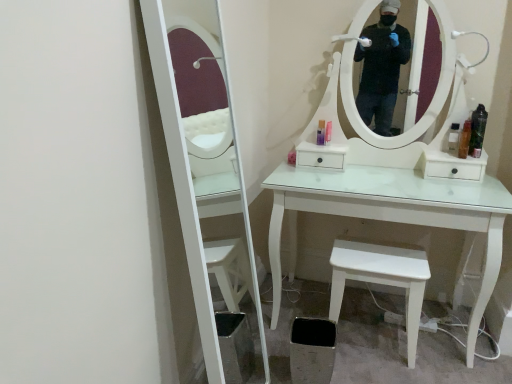
What do you see at coordinates (328, 132) in the screenshot?
I see `pink plastic bottle at center, marked as the 4th toiletry in a right-to-left arrangement` at bounding box center [328, 132].

This screenshot has width=512, height=384. What do you see at coordinates (321, 133) in the screenshot? I see `matte purple bottle at center, placed as the fifth toiletry when sorted from right to left` at bounding box center [321, 133].

Describe the element at coordinates (382, 277) in the screenshot. The width and height of the screenshot is (512, 384). I see `white matte stool at lower right` at that location.

The width and height of the screenshot is (512, 384). I want to click on white matte stool at lower right, so click(x=382, y=277).

Identify the location of translucent plastic bottle at right, the 1th toiletry viewed from the right. (477, 130).

Is translucent plastic bottle at right, the fourth toiletry when ordered from left to right, turned away from matte purple bottle at center, the 1th toiletry from the left?

That's not correct — translucent plastic bottle at right, the fourth toiletry when ordered from left to right, is not looking away from matte purple bottle at center, the 1th toiletry from the left.

Locate an element on the screen. Image resolution: width=512 pixels, height=384 pixels. toiletry that is the 2nd one below the translucent plastic bottle at right, the fourth toiletry when ordered from left to right (from a real-world perspective) is located at coordinates (321, 133).

Does translucent plastic bottle at right, the fourth toiletry when ordered from left to right, have a larger size compared to matte purple bottle at center, placed as the fifth toiletry when sorted from right to left?

Indeed, translucent plastic bottle at right, the fourth toiletry when ordered from left to right, has a larger size compared to matte purple bottle at center, placed as the fifth toiletry when sorted from right to left.

Is translucent plastic bottle at right, acting as the 2th toiletry starting from the right, far from matte purple bottle at center, the 1th toiletry from the left?

They are positioned close to each other.

Which object is further away from the camera, matte purple bottle at center, the 1th toiletry from the left, or pink plastic bottle at center, which appears as the second toiletry when viewed from the left?

Positioned behind is matte purple bottle at center, the 1th toiletry from the left.

Is matte purple bottle at center, placed as the fifth toiletry when sorted from right to left, at the right side of pink plastic bottle at center, which appears as the second toiletry when viewed from the left?

No.

Between point (324, 139) and point (330, 127), which one is positioned in front?

Point (330, 127)

Which object is more forward, translucent plastic bottle at right, the 1th toiletry viewed from the right, or white matte stool at lower right?

white matte stool at lower right.

Is translucent plastic bottle at right, the 1th toiletry viewed from the right, positioned with its back to white matte stool at lower right?

No.

Who is shorter, translucent plastic bottle at right, placed as the 5th toiletry when sorted from left to right, or white matte stool at lower right?

translucent plastic bottle at right, placed as the 5th toiletry when sorted from left to right.

Considering the relative sizes of translucent plastic bottle at right, the 1th toiletry viewed from the right, and white matte stool at lower right in the image provided, is translucent plastic bottle at right, the 1th toiletry viewed from the right, smaller than white matte stool at lower right?

Yes.

Locate an element on the screen. Image resolution: width=512 pixels, height=384 pixels. stool below the translucent plastic bottle at right, placed as the 5th toiletry when sorted from left to right (from the image's perspective) is located at coordinates (382, 277).

Can you confirm if white matte stool at lower right is shorter than translucent plastic bottle at right, placed as the 5th toiletry when sorted from left to right?

No.

Based on their positions, is white matte stool at lower right located to the left or right of translucent plastic bottle at right, the 1th toiletry viewed from the right?

Clearly, white matte stool at lower right is on the left of translucent plastic bottle at right, the 1th toiletry viewed from the right, in the image.

Between white matte stool at lower right and translucent plastic bottle at right, the fourth toiletry when ordered from left to right, which one appears on the right side from the viewer's perspective?

translucent plastic bottle at right, the fourth toiletry when ordered from left to right.

From a real-world perspective, is white matte stool at lower right under translucent plastic bottle at right, the fourth toiletry when ordered from left to right?

Yes, from a real-world perspective, white matte stool at lower right is beneath translucent plastic bottle at right, the fourth toiletry when ordered from left to right.

Between point (412, 367) and point (464, 146), which one is positioned behind?

The point (464, 146) is farther.

Is white matte stool at lower right taller than translucent plastic bottle at right, acting as the 2th toiletry starting from the right?

Yes.

Looking at this image, can you confirm if translucent plastic bottle at right, placed as the 5th toiletry when sorted from left to right, is thinner than matte purple bottle at center, placed as the fifth toiletry when sorted from right to left?

No, translucent plastic bottle at right, placed as the 5th toiletry when sorted from left to right, is not thinner than matte purple bottle at center, placed as the fifth toiletry when sorted from right to left.

How many degrees apart are the facing directions of translucent plastic bottle at right, the 1th toiletry viewed from the right, and matte purple bottle at center, the 1th toiletry from the left?

There is a 0.00154-degree angle between the facing directions of translucent plastic bottle at right, the 1th toiletry viewed from the right, and matte purple bottle at center, the 1th toiletry from the left.

Is translucent plastic bottle at right, the 1th toiletry viewed from the right, far from matte purple bottle at center, placed as the fifth toiletry when sorted from right to left?

translucent plastic bottle at right, the 1th toiletry viewed from the right, is actually quite close to matte purple bottle at center, placed as the fifth toiletry when sorted from right to left.

Is translucent plastic bottle at right, the 1th toiletry viewed from the right, not inside matte purple bottle at center, the 1th toiletry from the left?

Yes.

Which is less distant, (448, 139) or (487, 113)?

Positioned in front is point (487, 113).

Does clear plastic bottle at right, which is the 3th toiletry from right to left, turn towards translucent plastic bottle at right, the 1th toiletry viewed from the right?

No, clear plastic bottle at right, which is the 3th toiletry from right to left, is not oriented towards translucent plastic bottle at right, the 1th toiletry viewed from the right.

Which object is positioned more to the left, clear plastic bottle at right, the third toiletry when ordered from left to right, or translucent plastic bottle at right, the 1th toiletry viewed from the right?

clear plastic bottle at right, the third toiletry when ordered from left to right.

From a real-world perspective, is clear plastic bottle at right, the third toiletry when ordered from left to right, on translucent plastic bottle at right, the 1th toiletry viewed from the right?

No, from a real-world perspective, clear plastic bottle at right, the third toiletry when ordered from left to right, is not above translucent plastic bottle at right, the 1th toiletry viewed from the right.

From a real-world perspective, starting from the translucent plastic bottle at right, the fourth toiletry when ordered from left to right, which toiletry is the 2nd one below it? Please provide its 2D coordinates.

[(321, 133)]

Identify the location of toiletry that is the 1st one above the pink plastic bottle at center, which appears as the second toiletry when viewed from the left (from a real-world perspective). (321, 133).

Based on their spatial positions, is clear plastic bottle at right, the third toiletry when ordered from left to right, or matte purple bottle at center, the 1th toiletry from the left, further from white matte stool at lower right?

matte purple bottle at center, the 1th toiletry from the left.

Looking at the image, which one is located closer to translucent plastic bottle at right, the fourth toiletry when ordered from left to right, clear plastic bottle at right, the third toiletry when ordered from left to right, or white matte stool at lower right?

clear plastic bottle at right, the third toiletry when ordered from left to right.

Considering their positions, is translucent plastic bottle at right, the fourth toiletry when ordered from left to right, positioned closer to clear plastic bottle at right, the third toiletry when ordered from left to right, than pink plastic bottle at center, which appears as the second toiletry when viewed from the left?

translucent plastic bottle at right, the fourth toiletry when ordered from left to right, lies closer to clear plastic bottle at right, the third toiletry when ordered from left to right, than the other object.

From the image, which object appears to be farther from pink plastic bottle at center, which appears as the second toiletry when viewed from the left, white matte stool at lower right or clear plastic bottle at right, which is the 3th toiletry from right to left?

The object further to pink plastic bottle at center, which appears as the second toiletry when viewed from the left, is white matte stool at lower right.

Estimate the real-world distances between objects in this image. Which object is closer to white matte stool at lower right, matte purple bottle at center, the 1th toiletry from the left, or pink plastic bottle at center, which appears as the second toiletry when viewed from the left?

The object closer to white matte stool at lower right is pink plastic bottle at center, which appears as the second toiletry when viewed from the left.

Estimate the real-world distances between objects in this image. Which object is further from clear plastic bottle at right, which is the 3th toiletry from right to left, translucent plastic bottle at right, the 1th toiletry viewed from the right, or translucent plastic bottle at right, the fourth toiletry when ordered from left to right?

translucent plastic bottle at right, the 1th toiletry viewed from the right, lies further to clear plastic bottle at right, which is the 3th toiletry from right to left, than the other object.

Looking at the image, which one is located closer to pink plastic bottle at center, marked as the 4th toiletry in a right-to-left arrangement, matte purple bottle at center, placed as the fifth toiletry when sorted from right to left, or translucent plastic bottle at right, the 1th toiletry viewed from the right?

matte purple bottle at center, placed as the fifth toiletry when sorted from right to left, is closer to pink plastic bottle at center, marked as the 4th toiletry in a right-to-left arrangement.

When comparing their distances from matte purple bottle at center, placed as the fifth toiletry when sorted from right to left, does pink plastic bottle at center, which appears as the second toiletry when viewed from the left, or clear plastic bottle at right, the third toiletry when ordered from left to right, seem closer?

Based on the image, pink plastic bottle at center, which appears as the second toiletry when viewed from the left, appears to be nearer to matte purple bottle at center, placed as the fifth toiletry when sorted from right to left.

Where is `toiletry between pink plastic bottle at center, which appears as the second toiletry when viewed from the left, and translucent plastic bottle at right, acting as the 2th toiletry starting from the right`? Image resolution: width=512 pixels, height=384 pixels. toiletry between pink plastic bottle at center, which appears as the second toiletry when viewed from the left, and translucent plastic bottle at right, acting as the 2th toiletry starting from the right is located at coordinates (453, 137).

At what (x,y) coordinates should I click in order to perform the action: click on toiletry between matte purple bottle at center, the 1th toiletry from the left, and clear plastic bottle at right, the third toiletry when ordered from left to right. Please return your answer as a coordinate pair (x, y). This screenshot has width=512, height=384. Looking at the image, I should click on (328, 132).

The width and height of the screenshot is (512, 384). I want to click on toiletry between clear plastic bottle at right, which is the 3th toiletry from right to left, and white matte stool at lower right, in the vertical direction, so click(x=464, y=140).

Locate an element on the screen. The image size is (512, 384). toiletry positioned between translucent plastic bottle at right, the fourth toiletry when ordered from left to right, and clear plastic bottle at right, the third toiletry when ordered from left to right, from near to far is located at coordinates (477, 130).